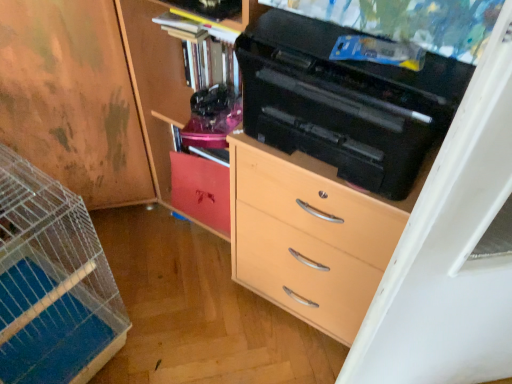
Where is `wooden cabinet at left, the 3th cabinetry from the right`? wooden cabinet at left, the 3th cabinetry from the right is located at coordinates (72, 99).

Identify the location of wooden cabinet at left, which appears as the 1th cabinetry when viewed from the left. The width and height of the screenshot is (512, 384). (72, 99).

Considering the sizes of objects wooden cabinet at left, which appears as the 1th cabinetry when viewed from the left, and matte wood chest of drawers at center in the image provided, who is thinner, wooden cabinet at left, which appears as the 1th cabinetry when viewed from the left, or matte wood chest of drawers at center?

matte wood chest of drawers at center.

How much distance is there between wooden cabinet at left, the 3th cabinetry from the right, and matte wood chest of drawers at center?

wooden cabinet at left, the 3th cabinetry from the right, and matte wood chest of drawers at center are 24.31 inches apart from each other.

Which is closer to the camera, (95, 20) or (258, 251)?

Point (95, 20) is closer to the camera than point (258, 251).

Is matte wood chest of drawers at center at the back of wooden cabinet at left, the 3th cabinetry from the right?

That's not correct — wooden cabinet at left, the 3th cabinetry from the right, is not looking away from matte wood chest of drawers at center.

This screenshot has width=512, height=384. Find the location of `the chest of drawers in front of the wooden cabinet at left, which appears as the 1th cabinetry when viewed from the left`. the chest of drawers in front of the wooden cabinet at left, which appears as the 1th cabinetry when viewed from the left is located at coordinates click(307, 237).

Could you tell me if matte wood chest of drawers at center is facing wooden cabinet at left, the 3th cabinetry from the right?

No, matte wood chest of drawers at center is not oriented towards wooden cabinet at left, the 3th cabinetry from the right.

Consider the image. From a real-world perspective, which is physically above, matte wood chest of drawers at center or wooden cabinet at left, which appears as the 1th cabinetry when viewed from the left?

wooden cabinet at left, which appears as the 1th cabinetry when viewed from the left, from a real-world perspective.

Is matte wood cabinet at center, the 1th cabinetry positioned from the right, completely or partially outside of matte wood chest of drawers at center?

matte wood cabinet at center, the 1th cabinetry positioned from the right, lies outside matte wood chest of drawers at center's area.

Who is bigger, matte wood cabinet at center, the 1th cabinetry positioned from the right, or matte wood chest of drawers at center?

matte wood cabinet at center, the 1th cabinetry positioned from the right, is bigger.

Considering the relative sizes of matte wood cabinet at center, the 3th cabinetry when ordered from left to right, and matte wood chest of drawers at center in the image provided, is matte wood cabinet at center, the 3th cabinetry when ordered from left to right, thinner than matte wood chest of drawers at center?

No.

From a real-world perspective, is matte wood cabinet at center, the 3th cabinetry when ordered from left to right, under matte wood chest of drawers at center?

No.

Who is taller, matte wood chest of drawers at center or matte wood cabinet at center, arranged as the second cabinetry when viewed from the right?

matte wood chest of drawers at center.

From the image's perspective, is matte wood chest of drawers at center below matte wood cabinet at center, arranged as the second cabinetry when viewed from the right?

Indeed, from the image's perspective, matte wood chest of drawers at center is shown beneath matte wood cabinet at center, arranged as the second cabinetry when viewed from the right.

The height and width of the screenshot is (384, 512). What are the coordinates of `the 2nd cabinetry counting from the left of the matte wood chest of drawers at center` in the screenshot? It's located at (201, 190).

Based on the photo, considering the positions of objects matte wood chest of drawers at center and matte wood cabinet at center, placed as the 2th cabinetry when sorted from left to right, in the image provided, who is more to the right, matte wood chest of drawers at center or matte wood cabinet at center, placed as the 2th cabinetry when sorted from left to right,?

From the viewer's perspective, matte wood chest of drawers at center appears more on the right side.

Which cabinetry is the 2nd one when counting from the back of the matte wood cabinet at center, the 3th cabinetry when ordered from left to right? Please provide its 2D coordinates.

[(201, 190)]

Which object is positioned more to the left, matte wood cabinet at center, placed as the 2th cabinetry when sorted from left to right, or matte wood cabinet at center, the 3th cabinetry when ordered from left to right?

Positioned to the left is matte wood cabinet at center, placed as the 2th cabinetry when sorted from left to right.

From a real-world perspective, relative to matte wood cabinet at center, the 1th cabinetry positioned from the right, is matte wood cabinet at center, arranged as the second cabinetry when viewed from the right, vertically above or below?

In terms of real-world spatial position, matte wood cabinet at center, arranged as the second cabinetry when viewed from the right, is below matte wood cabinet at center, the 1th cabinetry positioned from the right.

Is matte wood cabinet at center, placed as the 2th cabinetry when sorted from left to right, completely or partially outside of matte wood cabinet at center, the 1th cabinetry positioned from the right?

No, matte wood cabinet at center, placed as the 2th cabinetry when sorted from left to right, is not entirely external to matte wood cabinet at center, the 1th cabinetry positioned from the right.

Who is shorter, matte wood cabinet at center, the 3th cabinetry when ordered from left to right, or wooden cabinet at left, which appears as the 1th cabinetry when viewed from the left?

With less height is wooden cabinet at left, which appears as the 1th cabinetry when viewed from the left.

Is matte wood cabinet at center, the 1th cabinetry positioned from the right, touching wooden cabinet at left, the 3th cabinetry from the right?

No, matte wood cabinet at center, the 1th cabinetry positioned from the right, is not touching wooden cabinet at left, the 3th cabinetry from the right.

From the picture: Is wooden cabinet at left, which appears as the 1th cabinetry when viewed from the left, a part of matte wood cabinet at center, the 1th cabinetry positioned from the right?

No, wooden cabinet at left, which appears as the 1th cabinetry when viewed from the left, is not inside matte wood cabinet at center, the 1th cabinetry positioned from the right.

From the picture: Does wooden cabinet at left, which appears as the 1th cabinetry when viewed from the left, lie in front of matte wood cabinet at center, the 1th cabinetry positioned from the right?

No, it is not.

Would you say wooden cabinet at left, which appears as the 1th cabinetry when viewed from the left, is inside or outside matte wood cabinet at center, the 3th cabinetry when ordered from left to right?

wooden cabinet at left, which appears as the 1th cabinetry when viewed from the left, is not inside matte wood cabinet at center, the 3th cabinetry when ordered from left to right, it's outside.

Considering the sizes of objects wooden cabinet at left, which appears as the 1th cabinetry when viewed from the left, and matte wood cabinet at center, the 3th cabinetry when ordered from left to right, in the image provided, who is taller, wooden cabinet at left, which appears as the 1th cabinetry when viewed from the left, or matte wood cabinet at center, the 3th cabinetry when ordered from left to right,?

With more height is matte wood cabinet at center, the 3th cabinetry when ordered from left to right.

Which is in front, point (113, 106) or point (183, 203)?

Point (113, 106)

Locate an element on the screen. Image resolution: width=512 pixels, height=384 pixels. chest of drawers located on the right of wooden cabinet at left, which appears as the 1th cabinetry when viewed from the left is located at coordinates (307, 237).

Image resolution: width=512 pixels, height=384 pixels. In the image, there is a wooden cabinet at left, the 3th cabinetry from the right. What are the coordinates of `the chest of drawers below it (from the image's perspective)` in the screenshot? It's located at (307, 237).

Considering their positions, is matte wood cabinet at center, arranged as the second cabinetry when viewed from the right, positioned closer to wooden cabinet at left, the 3th cabinetry from the right, than matte wood cabinet at center, the 3th cabinetry when ordered from left to right?

matte wood cabinet at center, the 3th cabinetry when ordered from left to right.

Considering their positions, is wooden cabinet at left, which appears as the 1th cabinetry when viewed from the left, positioned closer to matte wood cabinet at center, the 3th cabinetry when ordered from left to right, than matte wood cabinet at center, arranged as the second cabinetry when viewed from the right?

matte wood cabinet at center, arranged as the second cabinetry when viewed from the right.

Estimate the real-world distances between objects in this image. Which object is closer to wooden cabinet at left, which appears as the 1th cabinetry when viewed from the left, matte wood cabinet at center, arranged as the second cabinetry when viewed from the right, or matte wood chest of drawers at center?

The object closer to wooden cabinet at left, which appears as the 1th cabinetry when viewed from the left, is matte wood cabinet at center, arranged as the second cabinetry when viewed from the right.

Looking at the image, which one is located closer to matte wood cabinet at center, placed as the 2th cabinetry when sorted from left to right, wooden cabinet at left, which appears as the 1th cabinetry when viewed from the left, or matte wood chest of drawers at center?

wooden cabinet at left, which appears as the 1th cabinetry when viewed from the left, is positioned closer to the anchor matte wood cabinet at center, placed as the 2th cabinetry when sorted from left to right.

When comparing their distances from wooden cabinet at left, which appears as the 1th cabinetry when viewed from the left, does matte wood chest of drawers at center or matte wood cabinet at center, placed as the 2th cabinetry when sorted from left to right, seem closer?

The object closer to wooden cabinet at left, which appears as the 1th cabinetry when viewed from the left, is matte wood cabinet at center, placed as the 2th cabinetry when sorted from left to right.

Considering their positions, is matte wood chest of drawers at center positioned further to matte wood cabinet at center, the 3th cabinetry when ordered from left to right, than matte wood cabinet at center, placed as the 2th cabinetry when sorted from left to right?

Among the two, matte wood chest of drawers at center is located further to matte wood cabinet at center, the 3th cabinetry when ordered from left to right.

Based on their spatial positions, is matte wood cabinet at center, arranged as the second cabinetry when viewed from the right, or wooden cabinet at left, the 3th cabinetry from the right, further from matte wood cabinet at center, the 1th cabinetry positioned from the right?

The object further to matte wood cabinet at center, the 1th cabinetry positioned from the right, is wooden cabinet at left, the 3th cabinetry from the right.

Estimate the real-world distances between objects in this image. Which object is further from matte wood cabinet at center, arranged as the second cabinetry when viewed from the right, matte wood cabinet at center, the 3th cabinetry when ordered from left to right, or matte wood chest of drawers at center?

matte wood chest of drawers at center lies further to matte wood cabinet at center, arranged as the second cabinetry when viewed from the right, than the other object.

Locate an element on the screen. cabinetry located between wooden cabinet at left, which appears as the 1th cabinetry when viewed from the left, and matte wood cabinet at center, the 3th cabinetry when ordered from left to right, in the left-right direction is located at coordinates (201, 190).